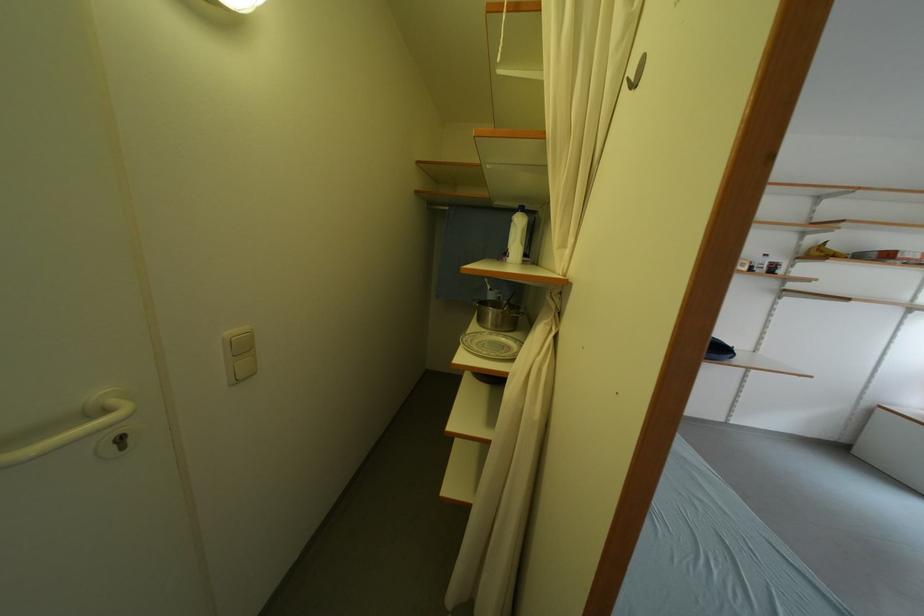
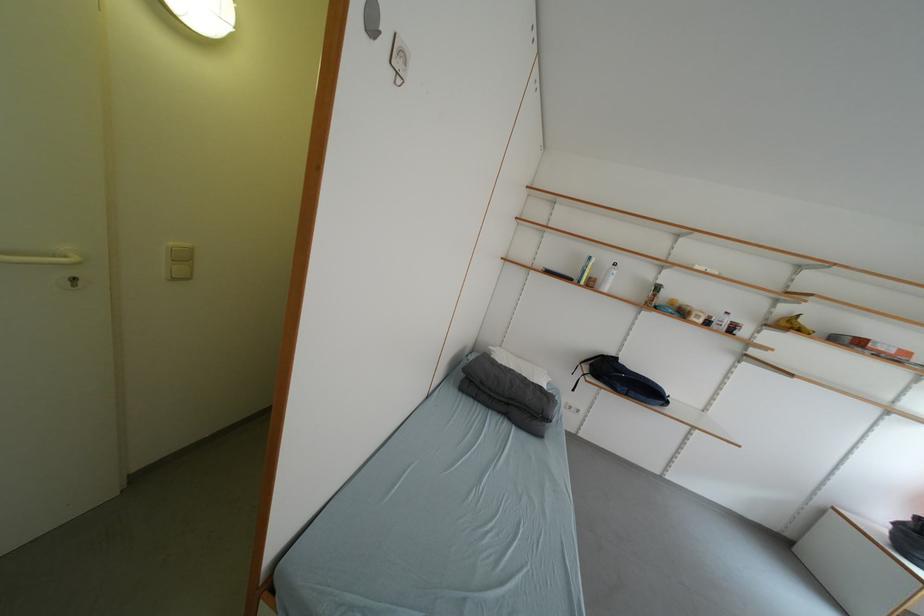
In the second image, find the point that corresponds to (x=829, y=257) in the first image.

(797, 328)